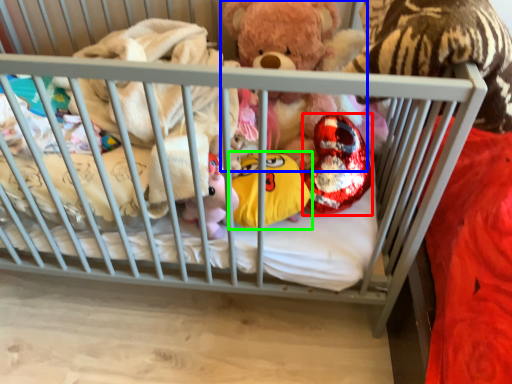
Question: Based on their relative distances, which object is nearer to toy (highlighted by a red box)? Choose from teddy bear (highlighted by a blue box) and toy (highlighted by a green box).

Choices:
 (A) teddy bear
 (B) toy

Answer: (B)